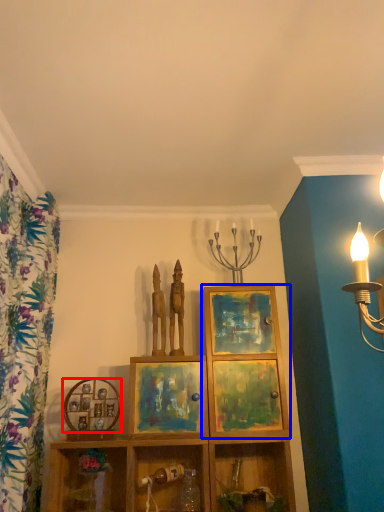
Question: Which object appears closest to the camera in this image, picture frame (highlighted by a red box) or cabinet (highlighted by a blue box)?

Choices:
 (A) picture frame
 (B) cabinet

Answer: (B)